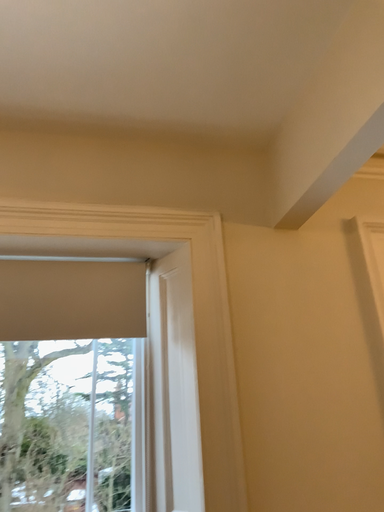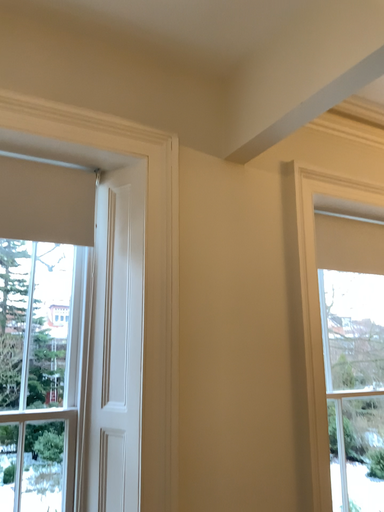
Question: How did the camera likely rotate when shooting the video?

Choices:
 (A) rotated upward
 (B) rotated downward

Answer: (B)